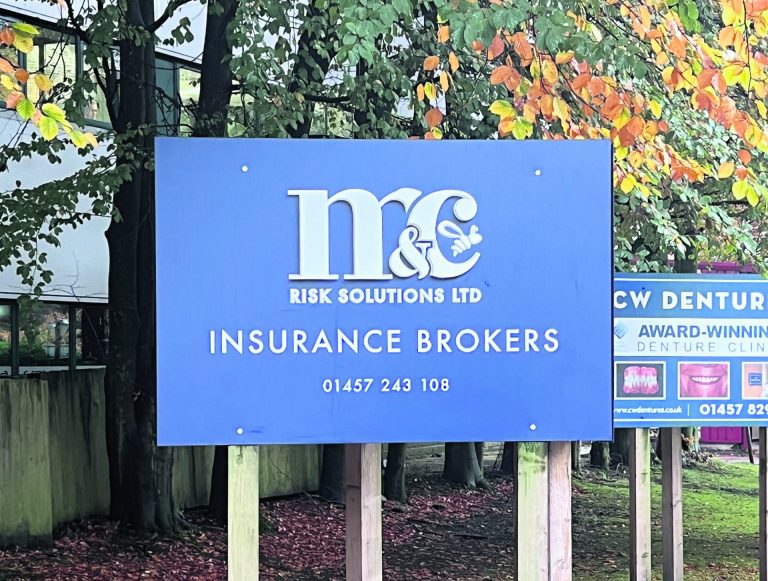
The width and height of the screenshot is (768, 581). I want to click on wooden supports, so click(x=246, y=515), click(x=359, y=520), click(x=531, y=523), click(x=560, y=525), click(x=636, y=514), click(x=670, y=512).